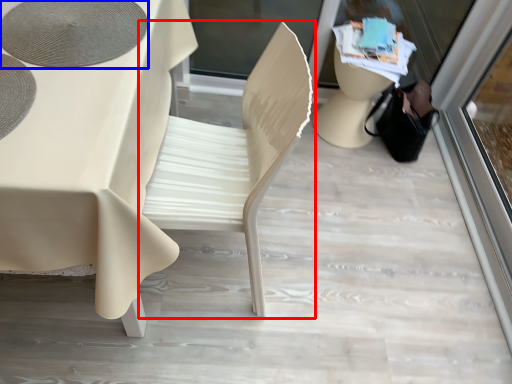
Question: Which point is closer to the camera, chair (highlighted by a red box) or oval (highlighted by a blue box)?

Choices:
 (A) chair
 (B) oval

Answer: (A)